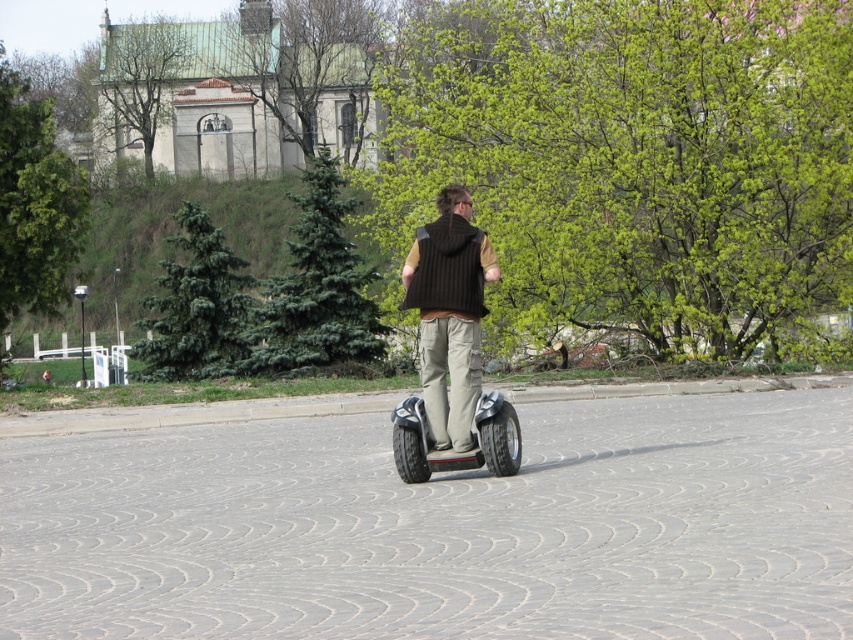
You are standing at the point with coordinates point (490, 440) and want to move towards the point with coordinates point (473, 442). Based on the scene, will you be moving towards the foreground or the background?

Since point (473, 442) is behind point (490, 440), moving towards it would mean moving towards the background.

You are a fashion designer observing the scene. You need to create a new line of clothing that will be showcased next to the black rubber segway at center. Considering the knit brown vest at center, which is larger in size, what adjustment would you suggest for the vest to ensure it doesn t overpower the segway in the display?

Since the knit brown vest at center is larger than the black rubber segway at center, to prevent it from overpowering the Segway in the display, you could reduce the size of the vest or choose a smaller model to maintain visual balance between the two items.